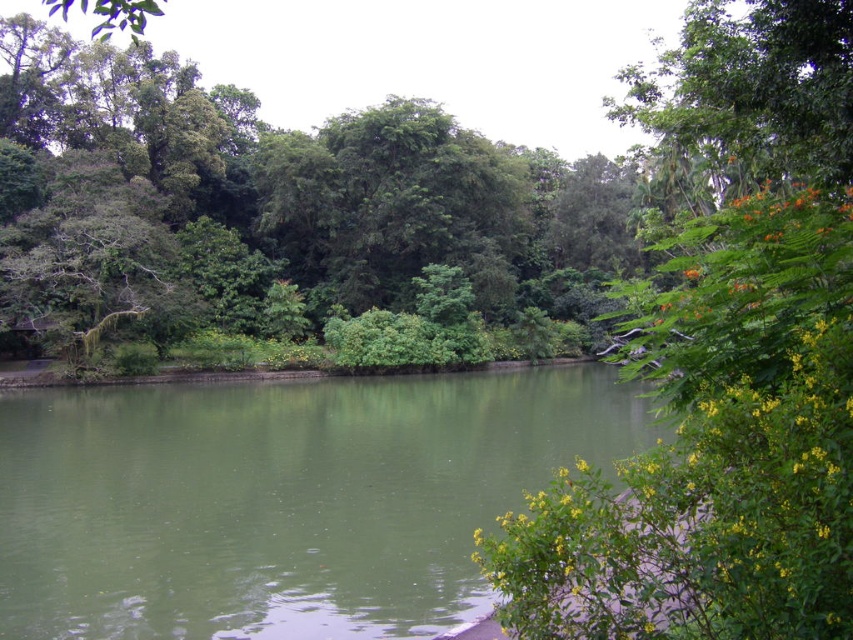
Question: Can you confirm if green smooth water at center is bigger than green leafy trees at upper center?

Choices:
 (A) no
 (B) yes

Answer: (A)

Question: Does green smooth water at center come in front of green leafy trees at upper center?

Choices:
 (A) no
 (B) yes

Answer: (B)

Question: Among these objects, which one is nearest to the camera?

Choices:
 (A) green leafy trees at upper center
 (B) green smooth water at center

Answer: (B)

Question: Is green smooth water at center to the right of green leafy trees at upper center from the viewer's perspective?

Choices:
 (A) yes
 (B) no

Answer: (A)